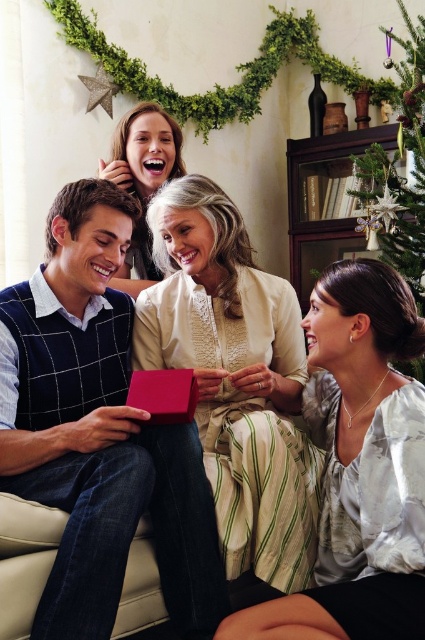
You are standing in the living room and want to move from point A to point B. Point A is at coordinate point (226, 512) and point B is at coordinate point (410, 35). Which point is closer to you?

Point A at coordinate point (226, 512) is closer to you than point B at coordinate point (410, 35).

You are a photographer trying to capture a group photo of the four people on the couch. You want to ensure that both the green textured christmas tree at upper right and the smooth beige blouse at upper center are visible in the frame. Which object should you position closer to the camera to achieve this?

The green textured christmas tree at upper right is taller than the smooth beige blouse at upper center. To ensure both are visible, position the green textured christmas tree at upper right closer to the camera so its height doesn not block the blouse.